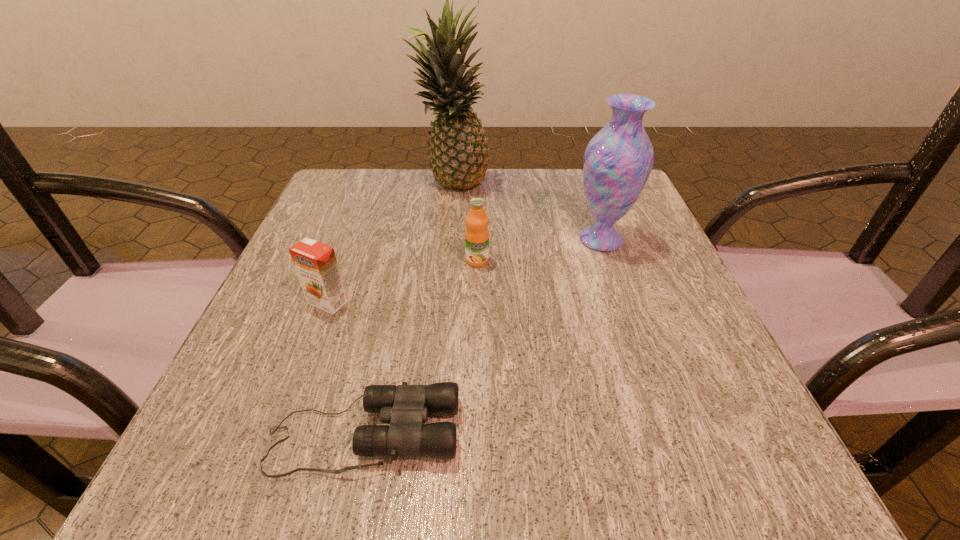
Identify the location of vacant area at the far edge. (392, 191).

In the image, there is a desktop. Identify the location of vacant space at the left edge. The width and height of the screenshot is (960, 540). (338, 223).

Locate an element on the screen. This screenshot has height=540, width=960. free region at the right edge is located at coordinates (648, 407).

The image size is (960, 540). Find the location of `free space at the far left corner`. free space at the far left corner is located at coordinates (312, 221).

Identify the location of vacant space at the far right corner. This screenshot has height=540, width=960. (583, 173).

The image size is (960, 540). Identify the location of free point between the second nearest object and the farther orange juice. (402, 281).

Identify the location of vacant point located between the shortest object and the tallest object. (408, 309).

The height and width of the screenshot is (540, 960). Find the location of `free point between the vase and the pineapple`. free point between the vase and the pineapple is located at coordinates (526, 213).

You are a GUI agent. You are given a task and a screenshot of the screen. Output one action in this format:
    pyautogui.click(x=<x>, y=<y>)
    Task: Click on the vacant space that is in between the right orange juice and the left orange juice
    
    Given the screenshot: What is the action you would take?
    pyautogui.click(x=402, y=281)

You are a GUI agent. You are given a task and a screenshot of the screen. Output one action in this format:
    pyautogui.click(x=<x>, y=<y>)
    Task: Click on the free space between the nearest object and the second nearest object
    This screenshot has width=960, height=540.
    Given the screenshot: What is the action you would take?
    pyautogui.click(x=346, y=368)